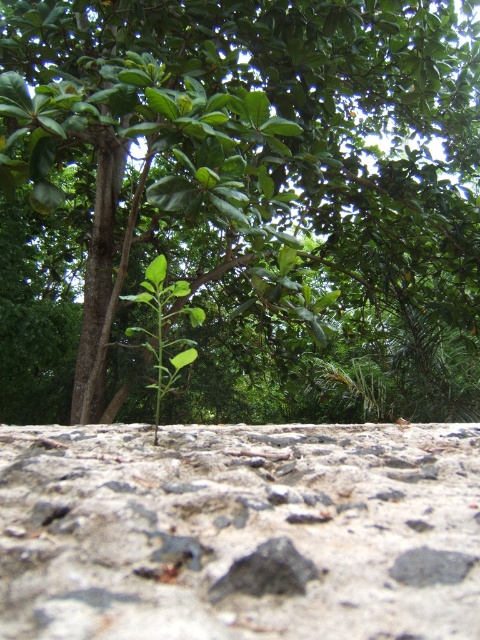
Question: Observing the image, what is the correct spatial positioning of green leafy tree at center in reference to gray rough concrete at center?

Choices:
 (A) above
 (B) below

Answer: (A)

Question: Which point is closer to the camera taking this photo?

Choices:
 (A) (155, 573)
 (B) (115, 394)

Answer: (A)

Question: Which point appears closest to the camera in this image?

Choices:
 (A) (445, 346)
 (B) (204, 472)

Answer: (B)

Question: Is green leafy tree at center positioned behind gray rough concrete at center?

Choices:
 (A) no
 (B) yes

Answer: (B)

Question: Does green leafy tree at center have a lesser width compared to gray rough concrete at center?

Choices:
 (A) no
 (B) yes

Answer: (A)